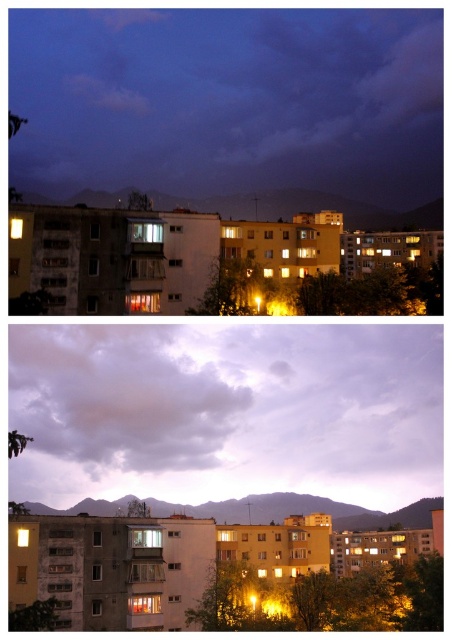
Does gray cotton cloud at upper center have a smaller size compared to matte yellow light at center?

No.

Who is positioned more to the left, gray cotton cloud at upper center or matte yellow light at center?

gray cotton cloud at upper center is more to the left.

Find the location of `gray cotton cloud at upper center`. gray cotton cloud at upper center is located at coordinates (117, 397).

Can you confirm if cloudy sky at upper center is positioned above matte yellow light at center?

Incorrect, cloudy sky at upper center is not positioned above matte yellow light at center.

Is cloudy sky at upper center further to the viewer compared to matte yellow light at center?

Yes, cloudy sky at upper center is further from the viewer.

Is point (343, 332) less distant than point (18, 538)?

No, (343, 332) is behind (18, 538).

This screenshot has height=640, width=452. What are the coordinates of `cloudy sky at upper center` in the screenshot? It's located at (226, 412).

Between cloudy sky at upper center and gray cotton cloud at upper center, which one is positioned higher?

gray cotton cloud at upper center is higher up.

Can you confirm if cloudy sky at upper center is wider than gray cotton cloud at upper center?

Yes.

Find the location of `cloudy sky at upper center`. cloudy sky at upper center is located at coordinates (226, 412).

At what (x,y) coordinates should I click in order to perform the action: click on cloudy sky at upper center. Please return your answer as a coordinate pair (x, y). The image size is (452, 640). Looking at the image, I should click on (226, 412).